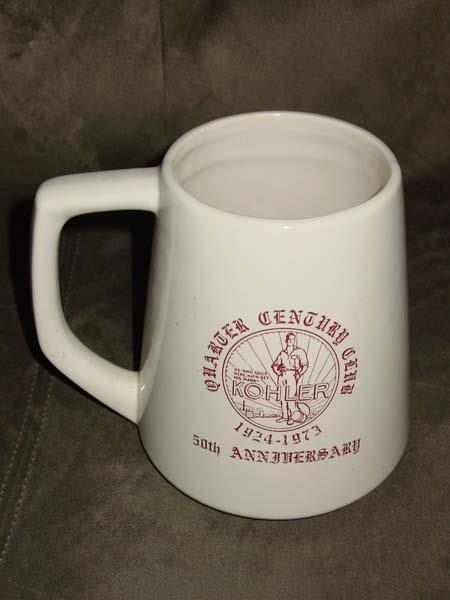
Locate an element on the screen. The image size is (450, 600). rounded corner of handle is located at coordinates (41, 189), (41, 349).